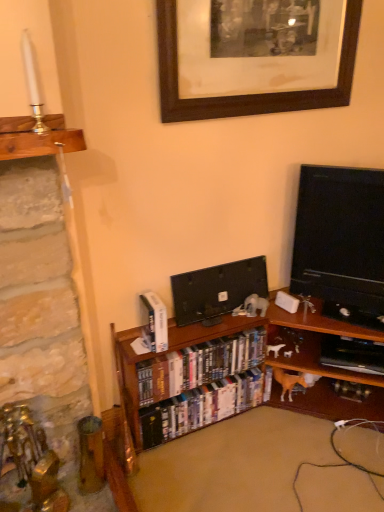
This screenshot has height=512, width=384. Identify the location of free point below black glossy tv at right, which ranks as the 2th television in left-to-right order (from a real-world perspective). (338, 316).